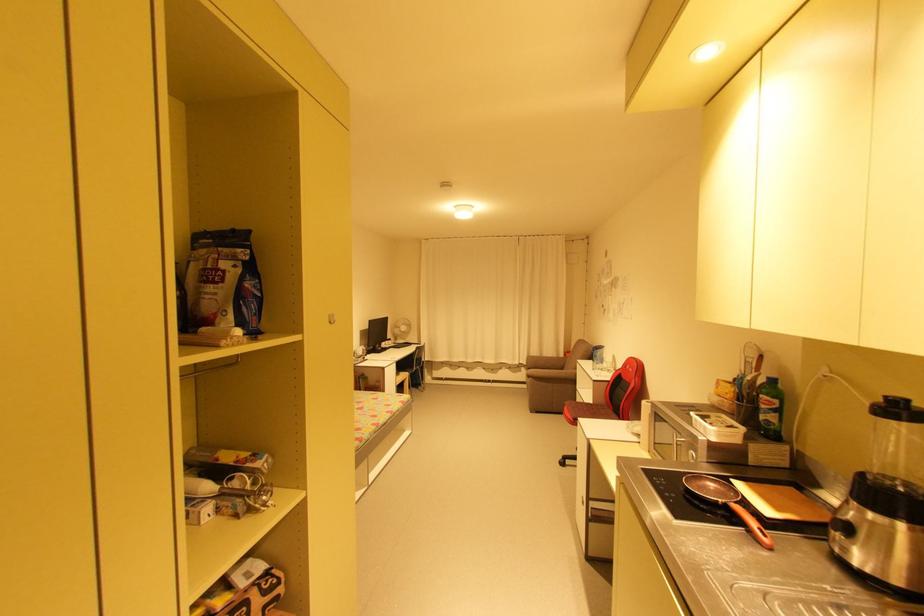
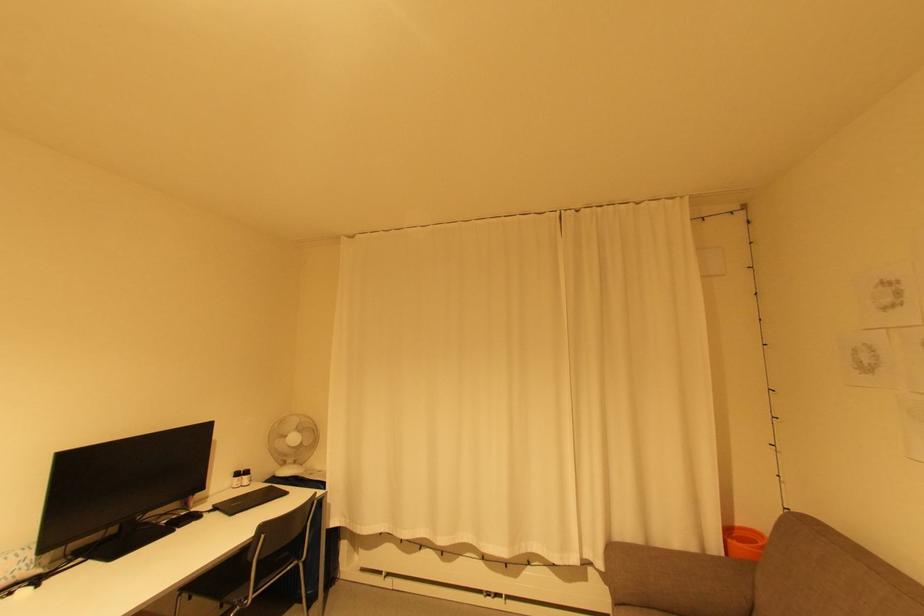
Where in the second image is the point corresponding to point (420, 359) from the first image?

(262, 562)